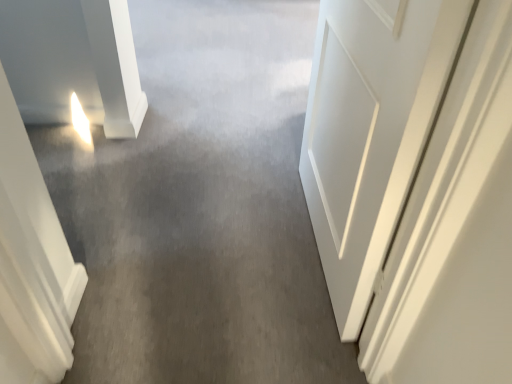
The height and width of the screenshot is (384, 512). I want to click on gray carpet at center, so click(x=201, y=209).

Image resolution: width=512 pixels, height=384 pixels. Describe the element at coordinates (201, 209) in the screenshot. I see `gray carpet at center` at that location.

I want to click on gray carpet at center, so click(x=201, y=209).